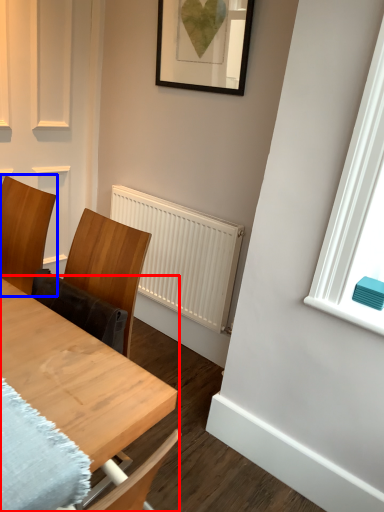
Question: Which point is closer to the camera, table (highlighted by a red box) or chair (highlighted by a blue box)?

Choices:
 (A) table
 (B) chair

Answer: (A)